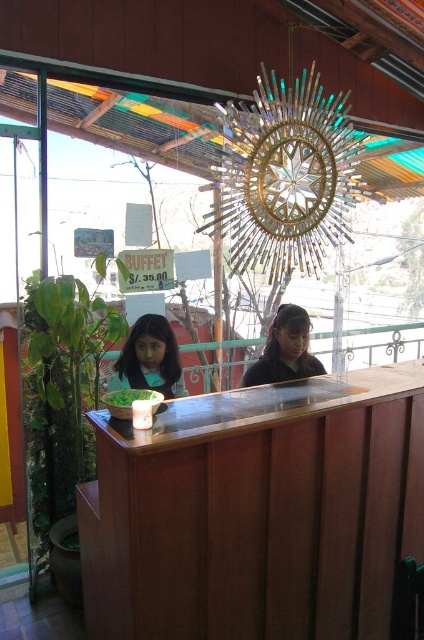
Question: Does brown wood table at center have a greater width compared to green leafy vegetable at center?

Choices:
 (A) yes
 (B) no

Answer: (A)

Question: Which of the following is the closest to the observer?

Choices:
 (A) brown wood table at center
 (B) matte black shirt at center

Answer: (A)

Question: Does matte black hair at center appear under green leafy vegetable at center?

Choices:
 (A) no
 (B) yes

Answer: (A)

Question: Which of the following is the closest to the observer?

Choices:
 (A) (131, 401)
 (B) (147, 326)
 (C) (217, 449)

Answer: (C)

Question: Does matte black hair at center appear over green leafy vegetable at center?

Choices:
 (A) yes
 (B) no

Answer: (A)

Question: Which object is the closest to the brown wood table at center?

Choices:
 (A) matte black shirt at center
 (B) matte black hair at center
 (C) green leafy vegetable at center

Answer: (C)